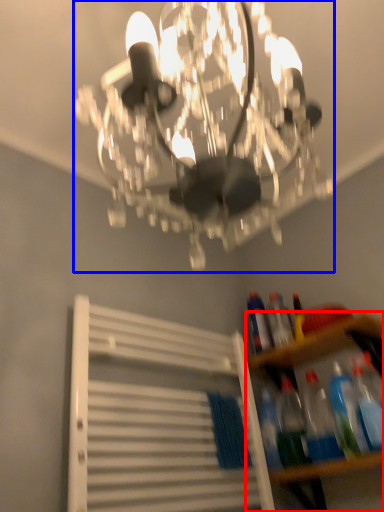
Question: Among these objects, which one is farthest to the camera, shelf (highlighted by a red box) or lamp (highlighted by a blue box)?

Choices:
 (A) shelf
 (B) lamp

Answer: (A)